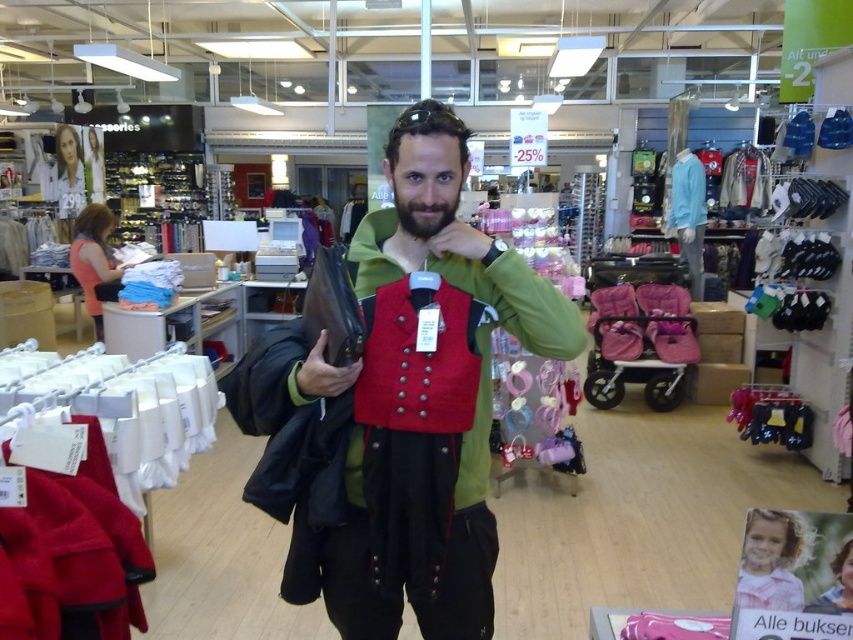
Question: In this image, where is matte red vest at center located relative to beardhairjaw at center?

Choices:
 (A) above
 (B) below

Answer: (B)

Question: Does matte red vest at center come in front of beardhairjaw at center?

Choices:
 (A) yes
 (B) no

Answer: (A)

Question: Among these objects, which one is farthest from the camera?

Choices:
 (A) matte red vest at center
 (B) beardhairjaw at center

Answer: (B)

Question: Can you confirm if matte red vest at center is wider than beardhairjaw at center?

Choices:
 (A) no
 (B) yes

Answer: (B)